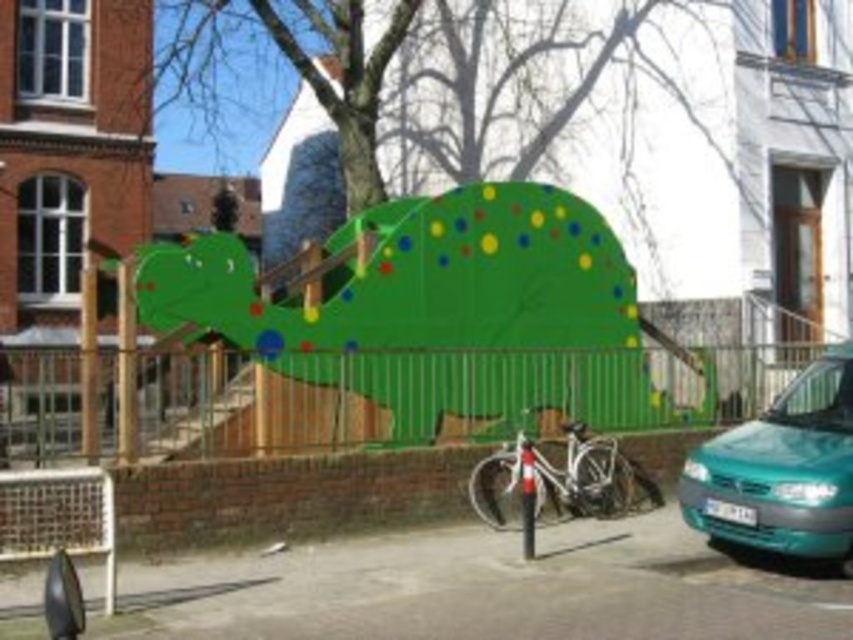
Describe the element at coordinates (428, 307) in the screenshot. I see `green matte climbing wall at center` at that location.

In the scene shown: Between green matte climbing wall at center and teal glossy van at lower right, which one has less height?

Standing shorter between the two is green matte climbing wall at center.

Image resolution: width=853 pixels, height=640 pixels. What do you see at coordinates (428, 307) in the screenshot? I see `green matte climbing wall at center` at bounding box center [428, 307].

This screenshot has height=640, width=853. In order to click on green matte climbing wall at center in this screenshot , I will do `click(428, 307)`.

Where is `teal glossy van at lower right`? The height and width of the screenshot is (640, 853). teal glossy van at lower right is located at coordinates (782, 470).

Looking at this image, who is positioned more to the right, teal glossy van at lower right or white metallic bicycle at center?

teal glossy van at lower right

Does point (752, 509) lie behind point (619, 472)?

No, (752, 509) is closer to viewer.

Locate an element on the screen. teal glossy van at lower right is located at coordinates (782, 470).

Does green matte climbing wall at center have a greater height compared to white metallic bicycle at center?

No.

Between green matte climbing wall at center and white metallic bicycle at center, which one is positioned lower?

white metallic bicycle at center is lower down.

Is point (534, 308) behind point (515, 492)?

That is True.

Locate an element on the screen. green matte climbing wall at center is located at coordinates (428, 307).